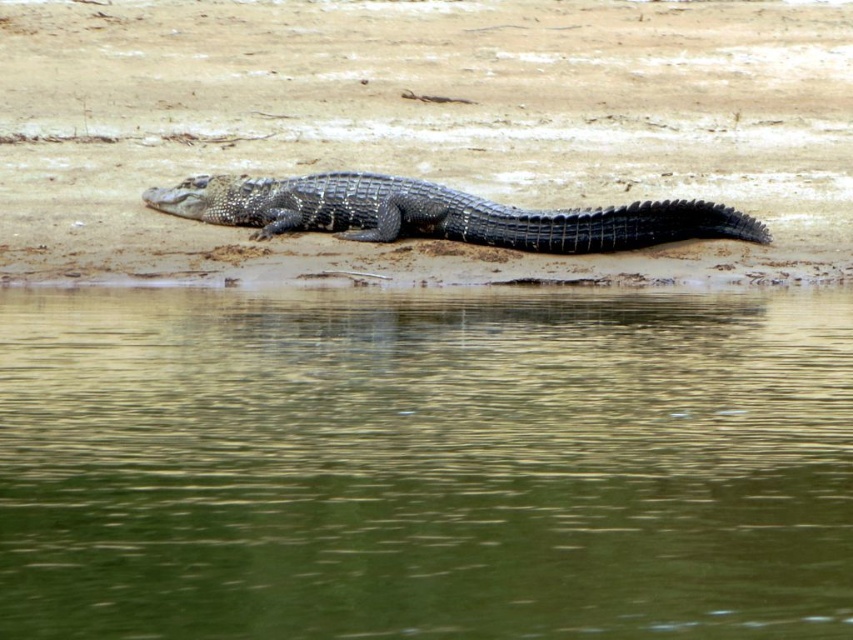
Question: Does green smooth water at lower center appear under shiny black crocodile at center?

Choices:
 (A) yes
 (B) no

Answer: (A)

Question: Which point is farther to the camera?

Choices:
 (A) shiny black crocodile at center
 (B) green smooth water at lower center

Answer: (A)

Question: Which of the following is the farthest from the observer?

Choices:
 (A) green smooth water at lower center
 (B) shiny black crocodile at center

Answer: (B)

Question: Can you confirm if green smooth water at lower center is smaller than shiny black crocodile at center?

Choices:
 (A) no
 (B) yes

Answer: (A)

Question: Is green smooth water at lower center further to camera compared to shiny black crocodile at center?

Choices:
 (A) yes
 (B) no

Answer: (B)